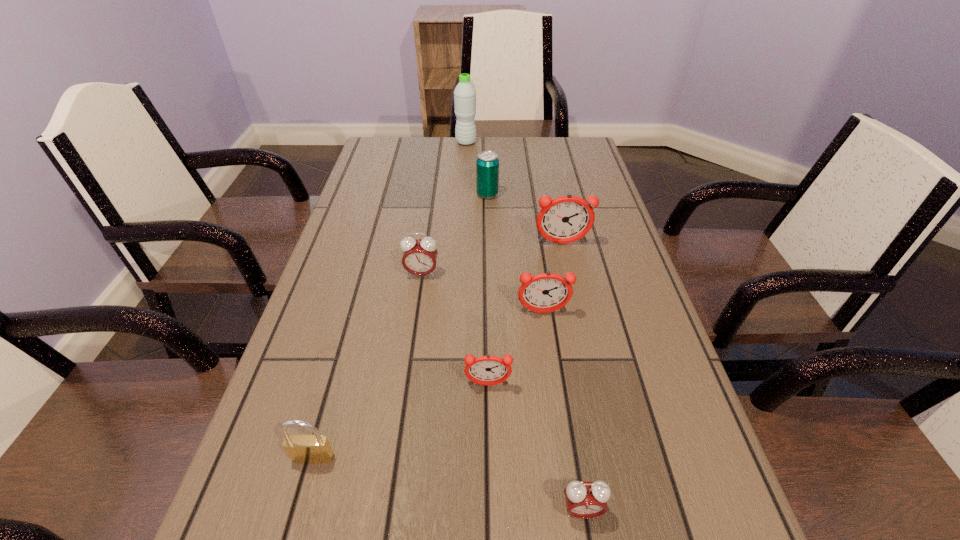
Find the location of a particular element. The height and width of the screenshot is (540, 960). the fourth closest alarm clock to the smaller pink alarm clock is located at coordinates (566, 219).

The image size is (960, 540). Find the location of `alarm clock that stands as the fourth closest to the farther pink alarm clock`. alarm clock that stands as the fourth closest to the farther pink alarm clock is located at coordinates (584, 500).

I want to click on reddish-pink alarm clock object that ranks as the third closest to the nearest alarm clock, so click(x=566, y=219).

Select which reddish-pink alarm clock appears as the second closest to the nearest alarm clock. Please provide its 2D coordinates. Your answer should be formatted as a tuple, i.e. [(x, y)], where the tuple contains the x and y coordinates of a point satisfying the conditions above.

[(547, 292)]